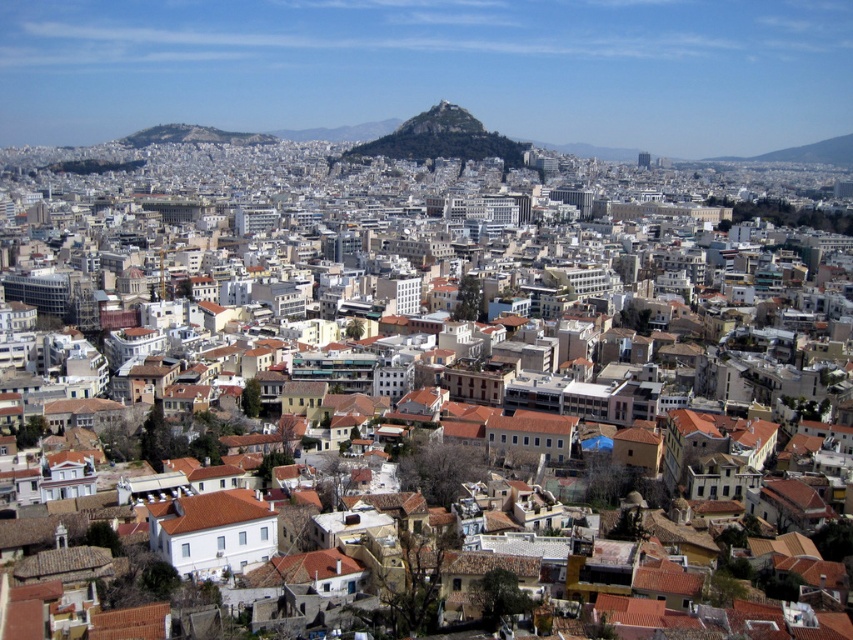
Question: Which point is farther to the camera?

Choices:
 (A) (486, 132)
 (B) (479, 134)

Answer: (A)

Question: Does green grassy hill at center lie in front of green rocky peak at center?

Choices:
 (A) yes
 (B) no

Answer: (A)

Question: Is green grassy hill at center thinner than green rocky peak at center?

Choices:
 (A) no
 (B) yes

Answer: (A)

Question: Which point is farther to the camera?

Choices:
 (A) green rocky peak at center
 (B) green grassy hill at center

Answer: (A)

Question: Is green grassy hill at center bigger than green rocky peak at center?

Choices:
 (A) yes
 (B) no

Answer: (A)